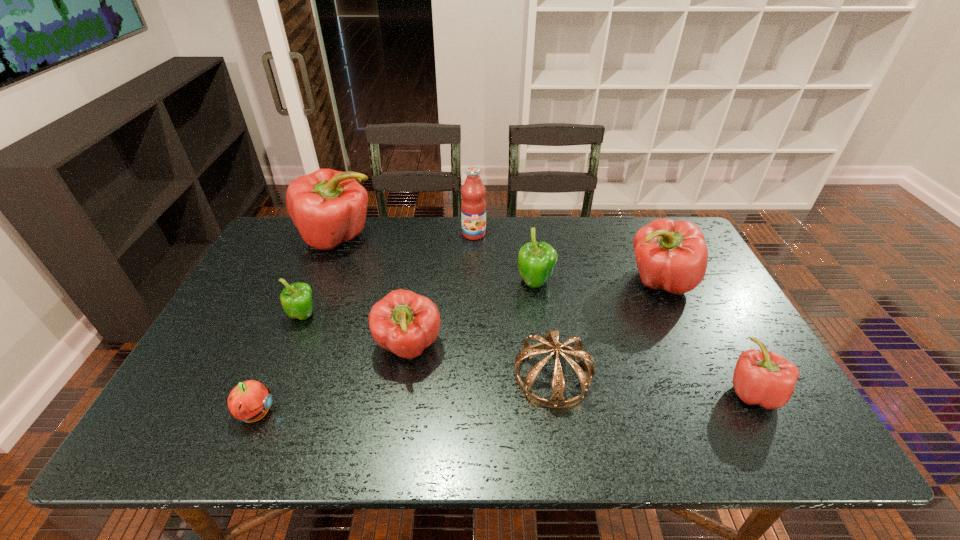
You are a GUI agent. You are given a task and a screenshot of the screen. Output one action in this format:
    pyautogui.click(x=<x>, y=<y>)
    Task: Click on the tallest bell pepper
    
    Given the screenshot: What is the action you would take?
    pyautogui.click(x=329, y=207)

Where is `the biggest pink bell pepper`? The image size is (960, 540). the biggest pink bell pepper is located at coordinates (329, 207).

Identify the location of fruit juice. (473, 205).

Find the location of `the second biggest pink bell pepper`. the second biggest pink bell pepper is located at coordinates (671, 255).

I want to click on the right green bell pepper, so tap(536, 260).

This screenshot has width=960, height=540. What are the coordinates of `the third bell pepper from right to left` in the screenshot? It's located at (536, 260).

Find the location of a particular element. This screenshot has width=960, height=540. the third pink bell pepper from right to left is located at coordinates (405, 323).

The height and width of the screenshot is (540, 960). I want to click on the third bell pepper from left to right, so click(405, 323).

Identify the location of the nearer green bell pepper. The width and height of the screenshot is (960, 540). (296, 298).

Locate an element on the screen. the smaller green bell pepper is located at coordinates (296, 298).